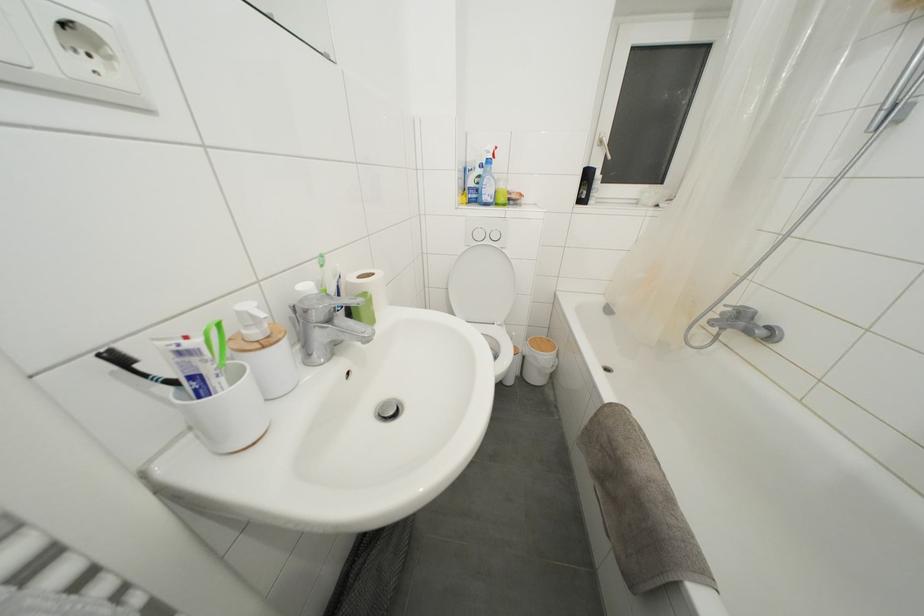
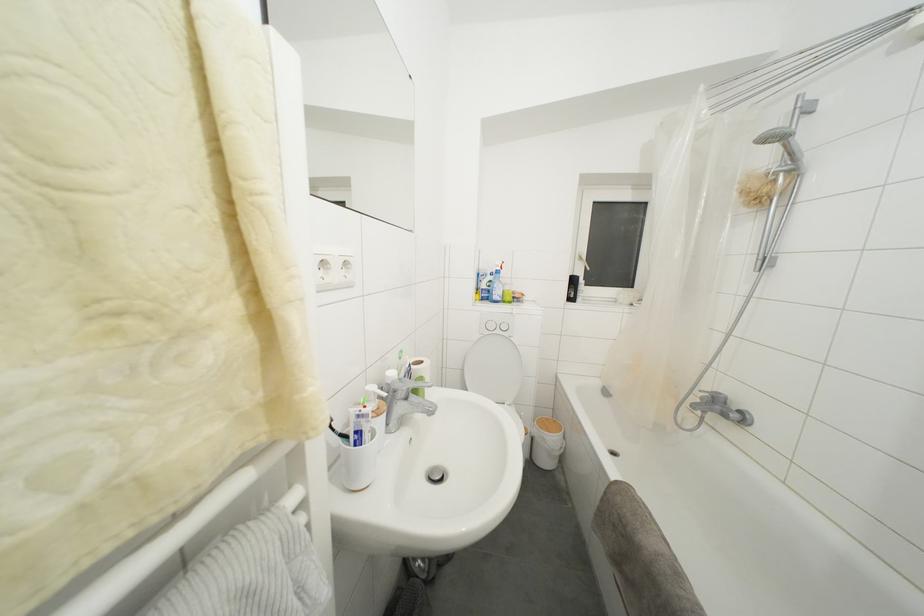
Where in the second image is the point corresponding to pixel 544 342 from the first image?

(552, 424)